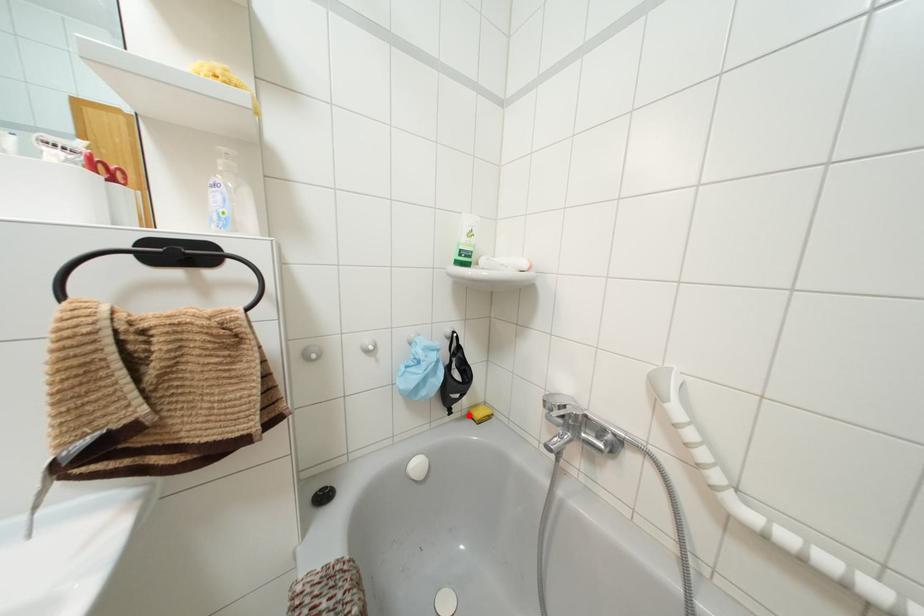
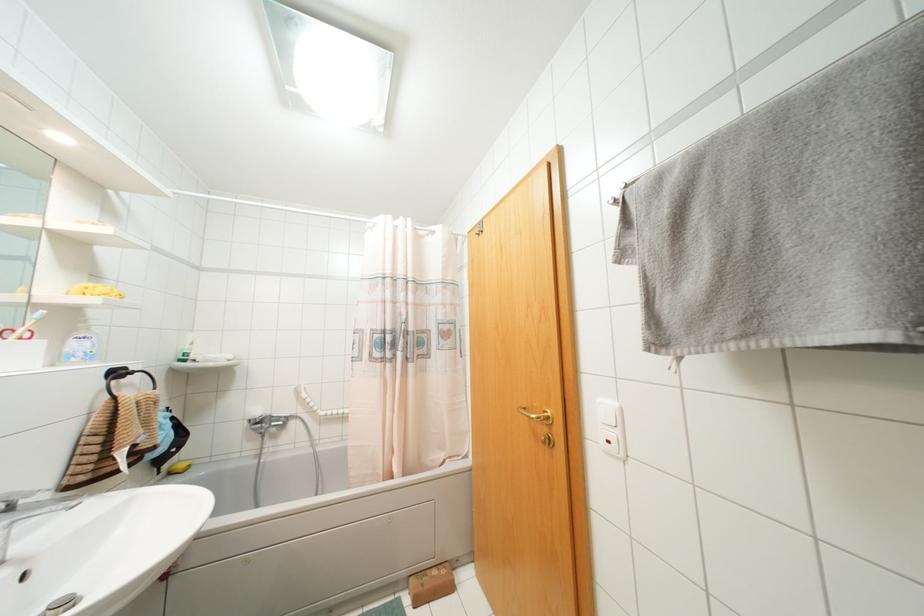
Question: I am providing you with two images of the same scene from different viewpoints. A red point is shown in image1. For the corresponding object point in image2, is it positioned nearer or farther from the camera?

Choices:
 (A) Nearer
 (B) Farther

Answer: (A)